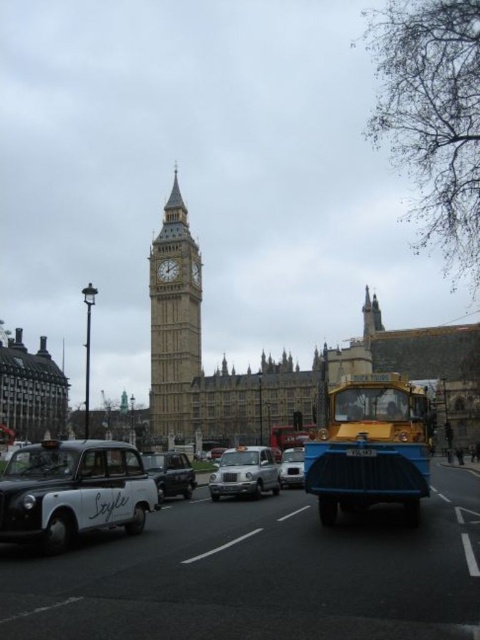
Is matte black taxi at lower left positioned at the back of black plastic license plate at center?

That is False.

Is point (63, 532) behind point (351, 451)?

No.

The width and height of the screenshot is (480, 640). In order to click on matte black taxi at lower left in this screenshot , I will do `click(72, 492)`.

Can you confirm if yellow matte taxi at center is shorter than black plastic license plate at center?

Incorrect, yellow matte taxi at center's height does not fall short of black plastic license plate at center's.

Is yellow matte taxi at center taller than black plastic license plate at center?

Yes, yellow matte taxi at center is taller than black plastic license plate at center.

This screenshot has width=480, height=640. Identify the location of yellow matte taxi at center. (371, 448).

Does matte black taxi at lower left have a greater width compared to shiny black car at center?

Yes, matte black taxi at lower left is wider than shiny black car at center.

Based on the photo, is matte black taxi at lower left above shiny black car at center?

No.

Where is `matte black taxi at lower left`? matte black taxi at lower left is located at coordinates (72, 492).